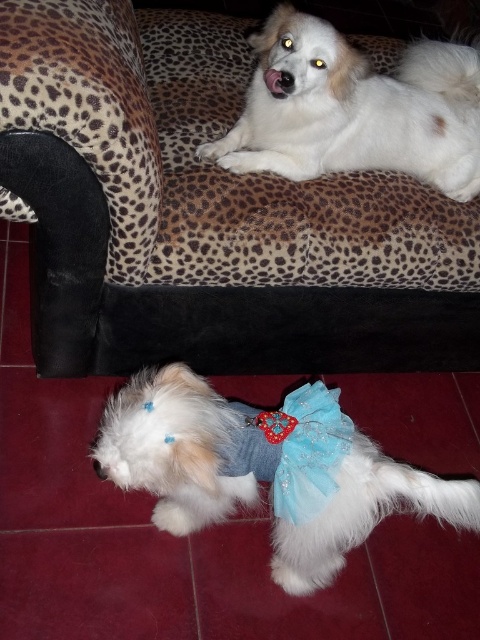
Question: Is leopard print fabric couch at upper center positioned behind blue satin bow tie at lower center?

Choices:
 (A) yes
 (B) no

Answer: (B)

Question: Among these objects, which one is nearest to the camera?

Choices:
 (A) white fluffy dog at upper center
 (B) leopard print fabric couch at upper center
 (C) white fluffy dog at lower center
 (D) blue satin bow tie at lower center

Answer: (C)

Question: Is leopard print fabric couch at upper center thinner than white fluffy dog at upper center?

Choices:
 (A) yes
 (B) no

Answer: (B)

Question: Which point appears farthest from the camera in this image?

Choices:
 (A) (210, 440)
 (B) (273, 426)
 (C) (356, 97)

Answer: (C)

Question: Can you confirm if white fluffy dog at upper center is positioned to the right of blue satin bow tie at lower center?

Choices:
 (A) no
 (B) yes

Answer: (B)

Question: Which point is farther to the camera?

Choices:
 (A) white fluffy dog at lower center
 (B) blue satin bow tie at lower center
 (C) white fluffy dog at upper center
 (D) leopard print fabric couch at upper center

Answer: (C)